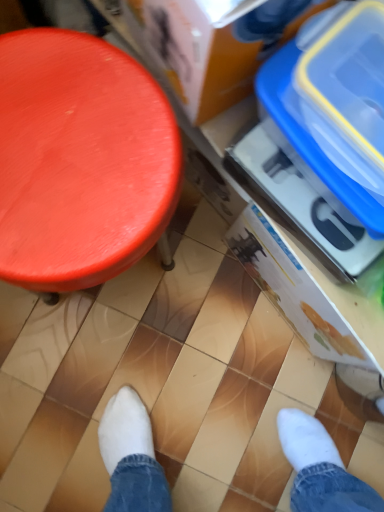
This screenshot has width=384, height=512. Identify the location of vacant point above smooth orange stool at left (from a real-world perspective). (70, 146).